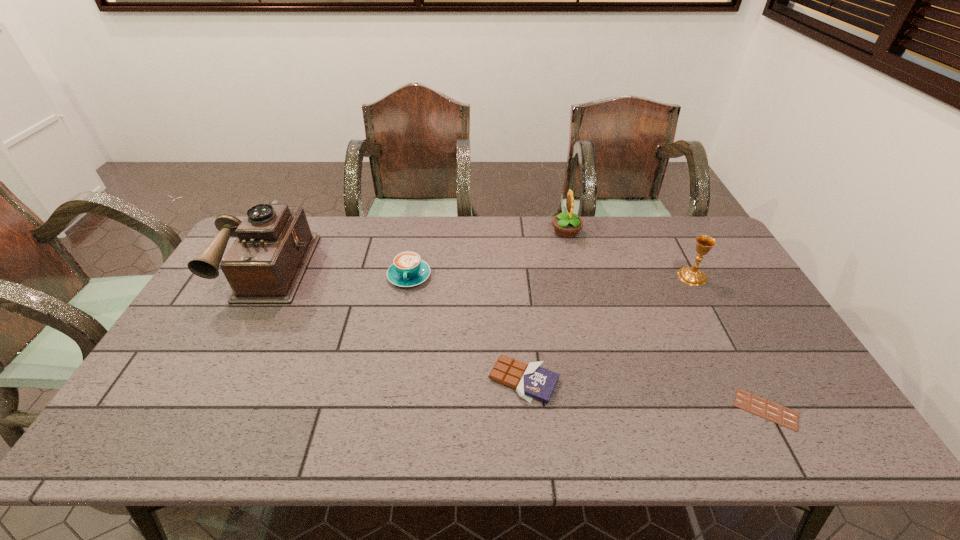
This screenshot has width=960, height=540. In the image, there is a desktop. What are the coordinates of `free space at the far right corner` in the screenshot? It's located at (692, 256).

This screenshot has height=540, width=960. I want to click on empty space between the fourth object from left to right and the shortest object, so click(x=666, y=320).

Locate an element on the screen. The height and width of the screenshot is (540, 960). empty space that is in between the taller chocolate bar and the right chocolate bar is located at coordinates (645, 395).

You are a GUI agent. You are given a task and a screenshot of the screen. Output one action in this format:
    pyautogui.click(x=<x>, y=<y>)
    Task: Click on the empty location between the third shortest object and the third object from right to left
    The image size is (960, 540).
    Given the screenshot: What is the action you would take?
    pyautogui.click(x=488, y=254)

Image resolution: width=960 pixels, height=540 pixels. In order to click on free space between the shortest object and the leftmost object in this screenshot , I will do `click(517, 338)`.

The height and width of the screenshot is (540, 960). Identify the location of free space between the shorter chocolate bar and the second object from left to right. (588, 343).

Where is `free area in between the shorter chocolate bar and the chalice`? The height and width of the screenshot is (540, 960). free area in between the shorter chocolate bar and the chalice is located at coordinates (730, 343).

The image size is (960, 540). Identify the location of vacant space that is in between the fifth object from right to left and the chalice. (551, 276).

Identify the location of empty space between the sunflower and the phonograph_record. (418, 248).

Where is `vacant area that lies between the third object from right to left and the chalice`? The width and height of the screenshot is (960, 540). vacant area that lies between the third object from right to left and the chalice is located at coordinates (629, 254).